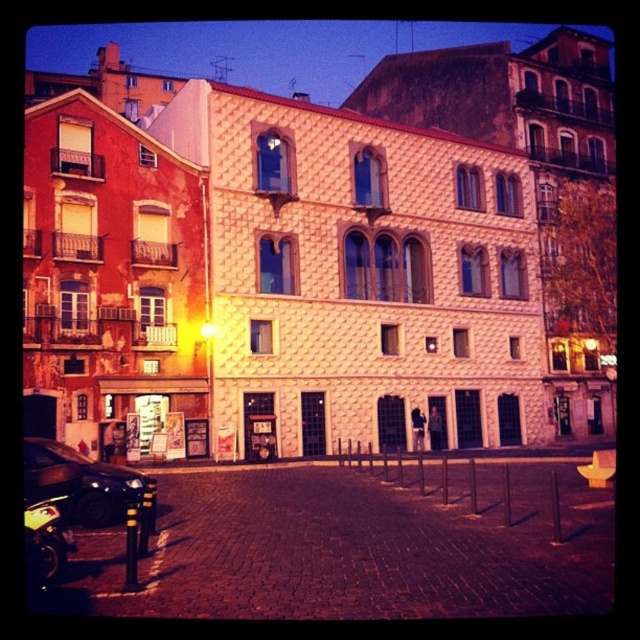
You are a pedestrian standing on the cobblestone street and want to walk towards the buildings. Which object, the shiny black car at lower left or the shiny black motorcycle at lower left, will you encounter first?

You will encounter the shiny black car at lower left first because it is closer to you than the shiny black motorcycle at lower left.

You are standing at the center of the cobblestone street in the image. There is a shiny black car at lower left. Where is the shiny black car located relative to your position?

The shiny black car at lower left is located at coordinates point (80, 483) relative to the image frame.

You are a pedestrian standing at the entrance of the cobblestone street. You need to cross the street to reach the cream and beige building with arched windows. There is a shiny black car at lower left and a shiny black motorcycle at lower left parked near the entrance. Can you safely cross the street between these two vehicles?

The shiny black car at lower left is 7.30 meters away from the shiny black motorcycle at lower left. This distance is sufficient for a pedestrian to safely cross the street between them.